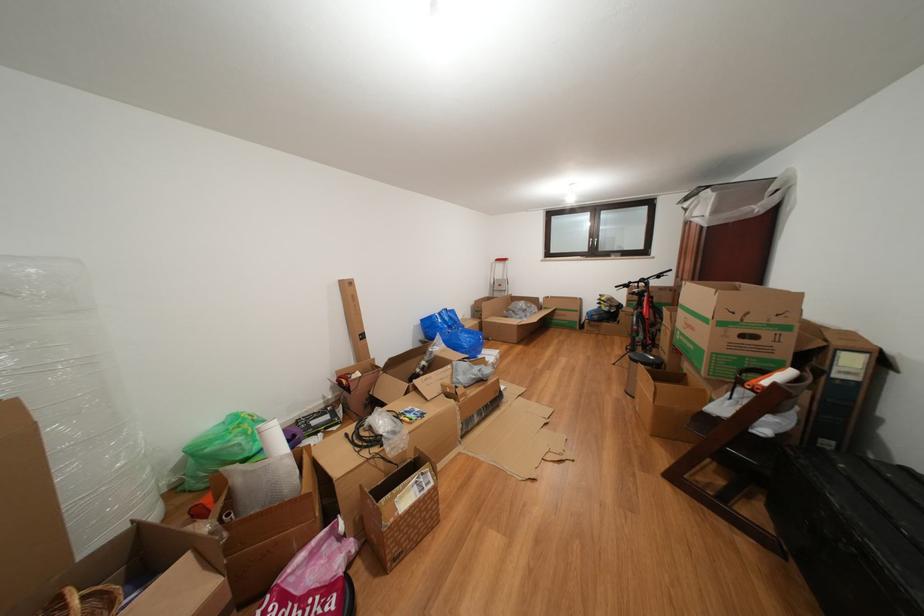
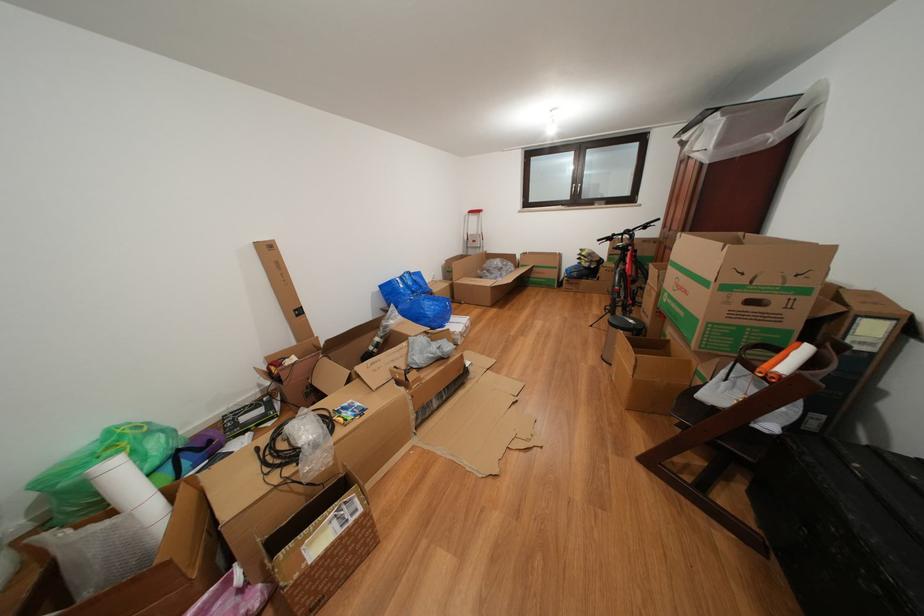
In the second image, find the point that corresponds to pixel 638 288 in the first image.

(622, 240)